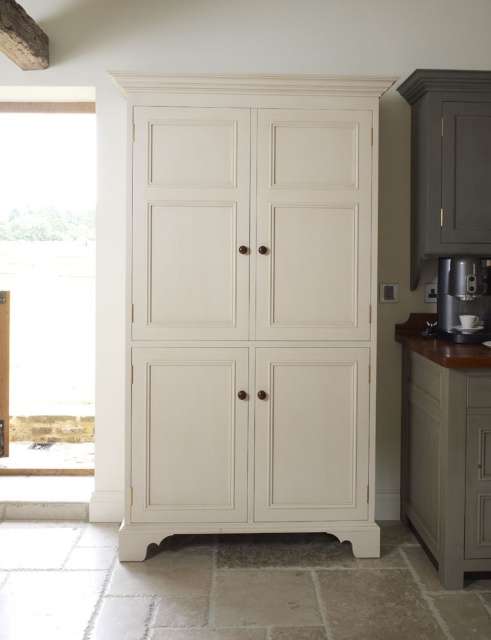
You are standing in the kitchen facing the matte cream cabinet at center and the wooden textured exhaust hood at upper left. Which object is positioned to the right of the other?

The matte cream cabinet at center is positioned to the right of the wooden textured exhaust hood at upper left.

You are standing in the kitchen and see the point marked at coordinates (251, 307). What object is located at that point?

The point at coordinates (251, 307) is occupied by the matte cream cabinet at center.

You are a kitchen designer assessing the layout. Which object, the satin silver metallic coffee machine at right or the wooden textured exhaust hood at upper left, requires more vertical space due to its height?

The satin silver metallic coffee machine at right requires more vertical space because it has a greater height compared to the wooden textured exhaust hood at upper left.